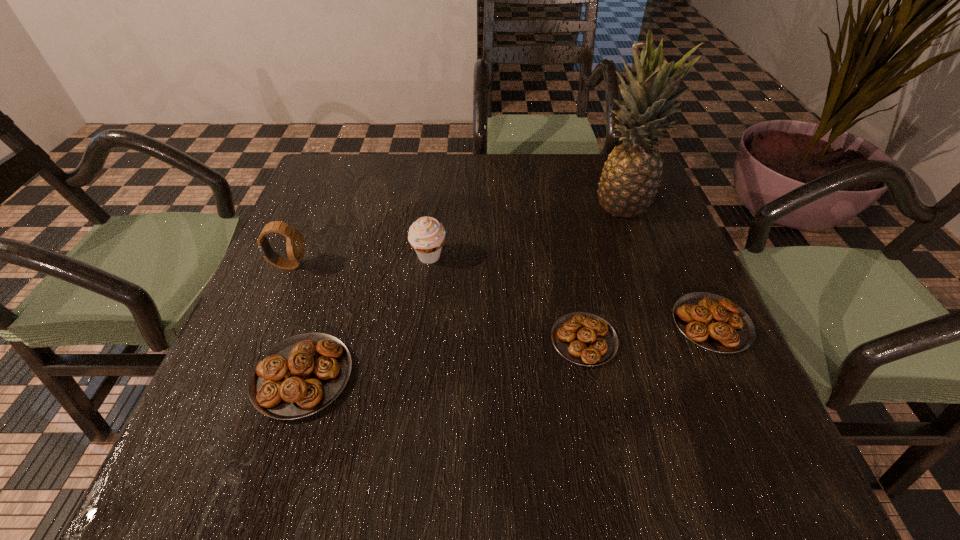
Locate an element on the screen. Image resolution: width=960 pixels, height=540 pixels. free space between the farthest object and the rightmost pastry is located at coordinates (667, 264).

Find the location of a particular element. This screenshot has height=540, width=960. free space that is in between the leftmost pastry and the third object from right to left is located at coordinates (444, 358).

I want to click on vacant area that lies between the shortest object and the leftmost pastry, so click(444, 358).

The image size is (960, 540). I want to click on free space that is in between the watch and the fourth object from right to left, so click(x=359, y=261).

Where is `vacant point located between the muffin and the leftmost pastry`? Image resolution: width=960 pixels, height=540 pixels. vacant point located between the muffin and the leftmost pastry is located at coordinates (366, 316).

Locate an element on the screen. This screenshot has width=960, height=540. free space between the watch and the leftmost pastry is located at coordinates (296, 321).

This screenshot has width=960, height=540. I want to click on free space between the watch and the tallest object, so click(x=455, y=235).

This screenshot has height=540, width=960. I want to click on object that is the fifth closest one to the leftmost pastry, so click(629, 182).

Select which object appears as the closest to the farthest object. Please provide its 2D coordinates. Your answer should be formatted as a tuple, i.e. [(x, y)], where the tuple contains the x and y coordinates of a point satisfying the conditions above.

[(713, 322)]

You are a GUI agent. You are given a task and a screenshot of the screen. Output one action in this format:
    pyautogui.click(x=<x>, y=<y>)
    Task: Click on the pastry that is the closest to the muffin
    The width and height of the screenshot is (960, 540).
    Given the screenshot: What is the action you would take?
    pyautogui.click(x=299, y=376)